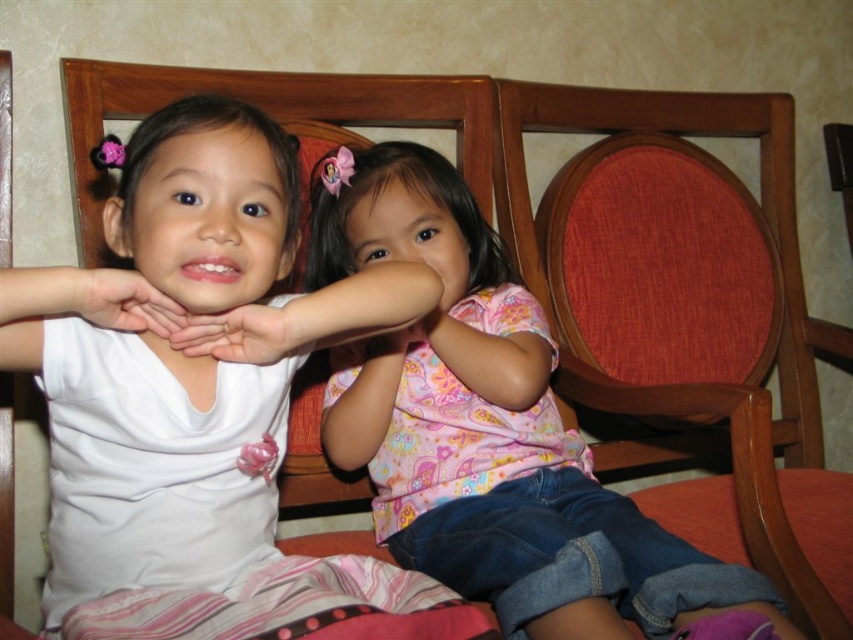
You are a photographer standing in front of the white matte shirt at left. You want to take a clear photo of it. What is the minimum distance you should maintain to ensure the shirt is in focus?

The white matte shirt at left and viewer are 24.21 inches apart, so you should maintain a distance of at least 24.21 inches to ensure the shirt is in focus.

You are a photographer trying to capture a candid shot of the two children. You notice the white matte arm at center and the matte white hands at center. How far apart are these two objects in centimeters?

The white matte arm at center and the matte white hands at center are 8.12 centimeters apart.